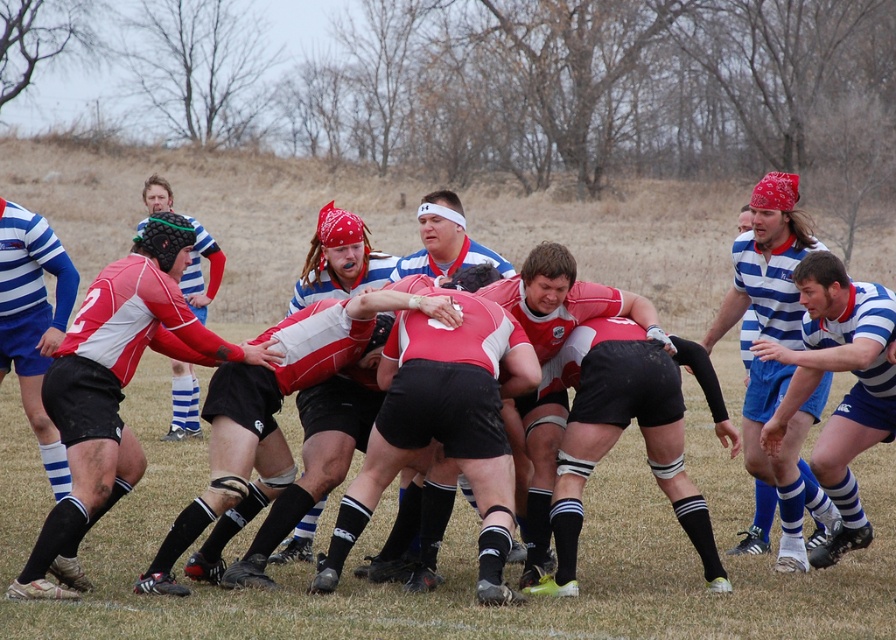
You are a referee observing the scrum during a rugby match. You notice the blue striped jersey at right and the matte red jersey at center. Which player is standing taller in this scrum?

The blue striped jersey at right is taller than the matte red jersey at center.

You are a referee observing the scrum during a rugby match. You notice the blue striped jersey at center and the matte red jersey at center. Which team should you penalize if the scrum is not formed correctly according to the rule that the attacking team must be behind the ball?

The blue striped jersey at center should be penalized because they are in front of the matte red jersey at center, which violates the rule that the attacking team must be behind the ball.

What is located at the coordinate point (x=846, y=394) in the image?

The blue striped jersey at right is located at point (x=846, y=394).